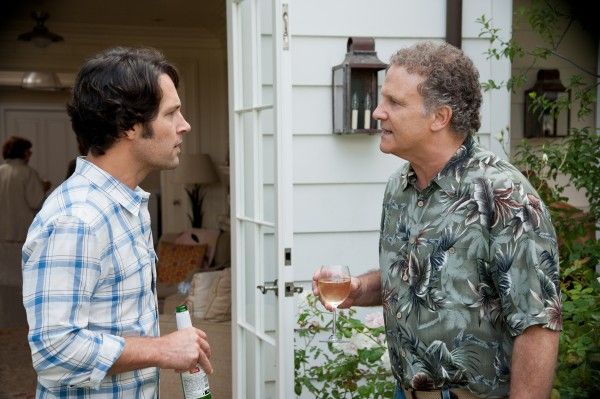
Find the location of a particular element. This screenshot has height=399, width=600. stem of wine glass is located at coordinates (334, 325).